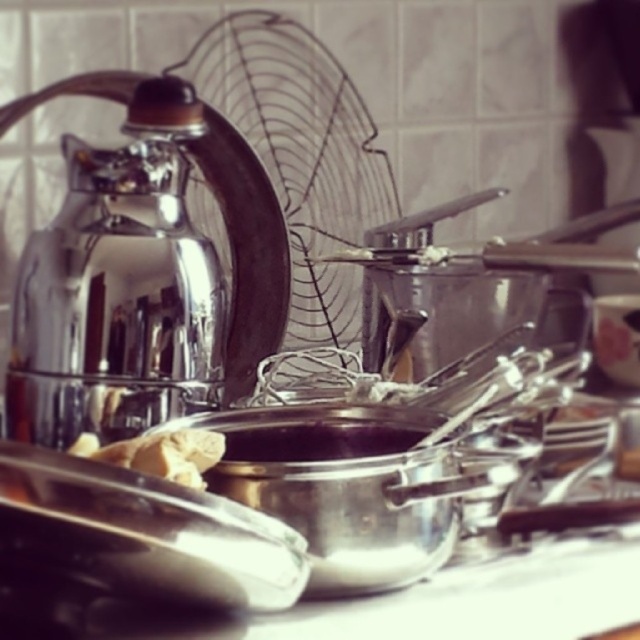
You are a chef preparing to place a new utensil on the countertop. The utensil is 12 centimeters wide. Looking at the shiny metallic kettle at left and the white crumbly dough at center, which object can the utensil fit next to without overlapping?

The utensil can fit next to the white crumbly dough at center because the shiny metallic kettle at left is wider than the white crumbly dough at center, so there is more space available next to the dough.

You are a chef preparing dough and need to move the shiny metallic kettle at left out of the way. Which direction should you move it so it doesn not block access to the white crumbly dough at center?

Since the shiny metallic kettle at left is to the left of the white crumbly dough at center, you should move it to the right to avoid blocking access to the dough.

You are trying to place a 12 inch long spatula between the shiny metallic kettle at left and the wire whisk at right. Will it fit?

The distance between the shiny metallic kettle at left and the wire whisk at right is 14.81 inches. Since the spatula is 12 inches long, it will fit between them.